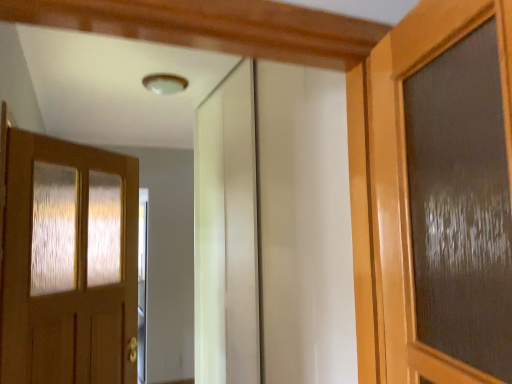
Question: From a real-world perspective, is white glossy elevator at center located beneath matte wood door at left?

Choices:
 (A) yes
 (B) no

Answer: (B)

Question: Could you tell me if white glossy elevator at center is turned towards matte wood door at left?

Choices:
 (A) yes
 (B) no

Answer: (A)

Question: Can matte wood door at left be found inside white glossy elevator at center?

Choices:
 (A) no
 (B) yes

Answer: (A)

Question: Considering the relative positions of white glossy elevator at center and matte wood door at left in the image provided, is white glossy elevator at center to the left of matte wood door at left from the viewer's perspective?

Choices:
 (A) yes
 (B) no

Answer: (B)

Question: Can you confirm if white glossy elevator at center is shorter than matte wood door at left?

Choices:
 (A) yes
 (B) no

Answer: (B)

Question: Would you consider white glossy elevator at center to be distant from matte wood door at left?

Choices:
 (A) yes
 (B) no

Answer: (B)

Question: Is matte wood door at left to the left of white glossy elevator at center from the viewer's perspective?

Choices:
 (A) yes
 (B) no

Answer: (A)

Question: Does matte wood door at left come in front of white glossy elevator at center?

Choices:
 (A) no
 (B) yes

Answer: (A)

Question: Does matte wood door at left have a lesser height compared to white glossy elevator at center?

Choices:
 (A) no
 (B) yes

Answer: (B)

Question: From a real-world perspective, is matte wood door at left physically above white glossy elevator at center?

Choices:
 (A) no
 (B) yes

Answer: (A)

Question: From a real-world perspective, is matte wood door at left below white glossy elevator at center?

Choices:
 (A) yes
 (B) no

Answer: (A)

Question: Is matte wood door at left bigger than white glossy elevator at center?

Choices:
 (A) yes
 (B) no

Answer: (B)

Question: From a real-world perspective, relative to matte wood door at left, is white glossy elevator at center vertically above or below?

Choices:
 (A) above
 (B) below

Answer: (A)